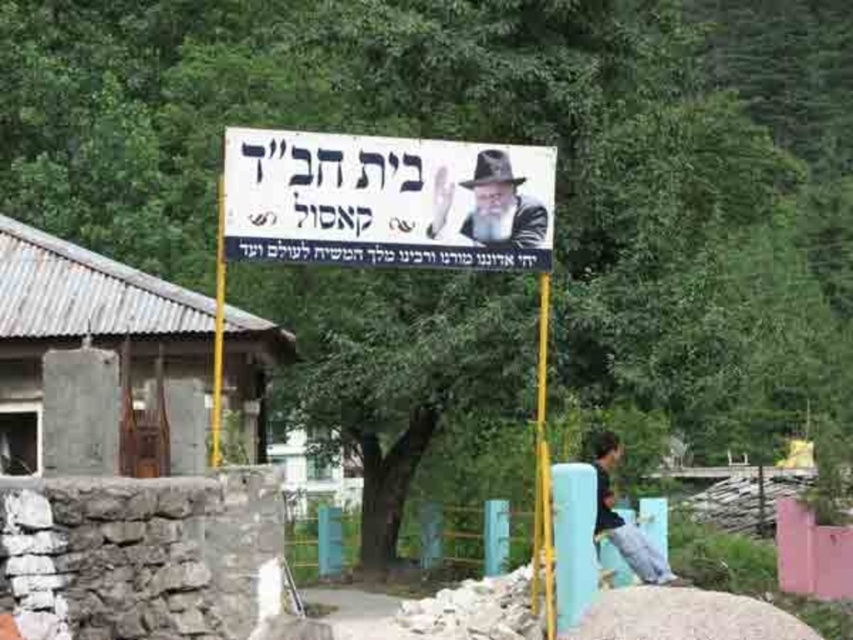
You are standing at the point marked by the coordinates point [100,358]. What is the nearest object to you in the scene?

The nearest object to you is the rusty metal hut at left because the point [100,358] is located on it.

You are a visitor approaching the signboard in the rural scene. You notice the yellow metallic pole at center and the light blue jeans at lower right. Which object is closer to you as you face the scene?

The yellow metallic pole at center is closer to you than the light blue jeans at lower right because it is positioned over it.

You are standing in front of the signboard near the stone structure. You see two points marked on the image at coordinates point (607, 474) and point (218, 253). Which point is closer to your eyes?

Point (218, 253) is closer to your eyes because it is less further to the camera than point (607, 474).